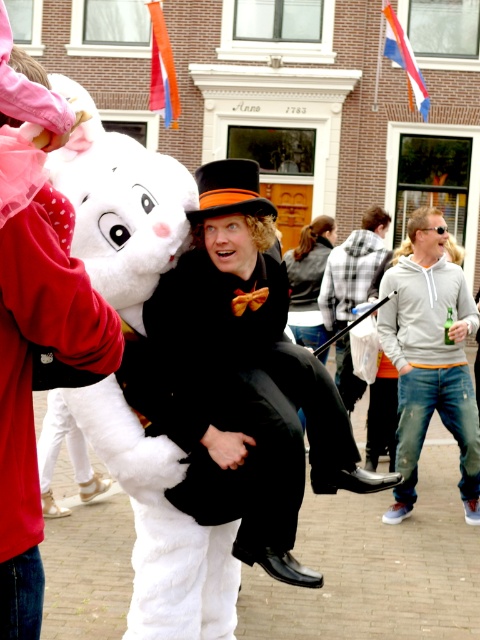
You are a photographer trying to capture a photo of the denim jeans at right and the black leather jacket at center. Based on their heights, which object should you focus on first if you want to include both in the frame without cropping?

The denim jeans at right is much taller than the black leather jacket at center, so you should focus on the denim jeans at right first to ensure both are fully visible in the frame.